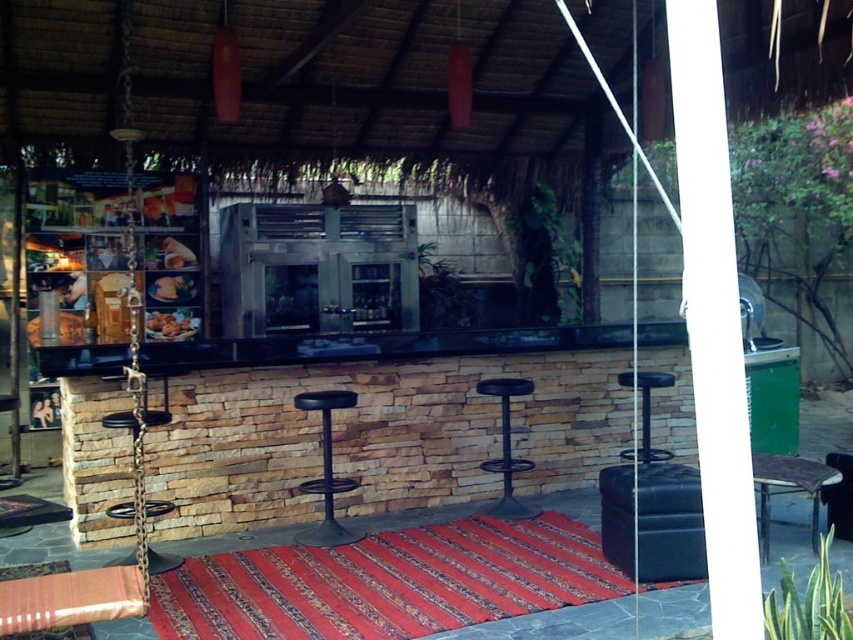
Question: Is black metal bar stool at center below black leather bar stool at center?

Choices:
 (A) yes
 (B) no

Answer: (A)

Question: Estimate the real-world distances between objects in this image. Which object is closer to the black metal bar stool at center?

Choices:
 (A) black matte bar stool at center
 (B) golden fried shrimp at center

Answer: (A)

Question: Based on their relative distances, which object is farther from the black metal bar stool at center?

Choices:
 (A) metallic chain bar stool at center
 (B) metallic stool at lower right
 (C) matte brown bread at center

Answer: (C)

Question: Is black matte bar stool at center thinner than matte brown bread at center?

Choices:
 (A) yes
 (B) no

Answer: (B)

Question: Is golden fried shrimp at center thinner than matte brown bread at center?

Choices:
 (A) no
 (B) yes

Answer: (A)

Question: Which object appears farthest from the camera in this image?

Choices:
 (A) metallic stool at lower right
 (B) black metal bar stool at center
 (C) black leather bar stool at center
 (D) black matte bar stool at center

Answer: (C)